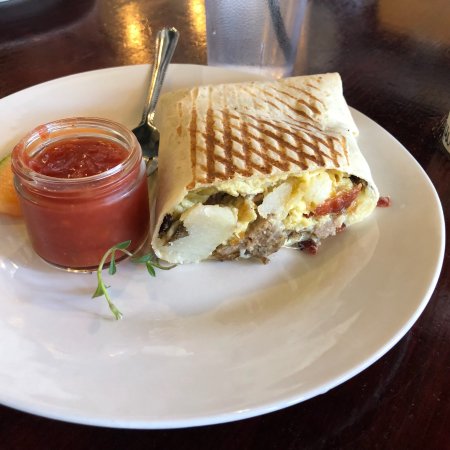
You are a GUI agent. You are given a task and a screenshot of the screen. Output one action in this format:
    pyautogui.click(x=<x>, y=<y>)
    Task: Click on the light reflections
    This screenshot has height=450, width=450.
    Given the screenshot: What is the action you would take?
    pyautogui.click(x=195, y=16), pyautogui.click(x=134, y=34)